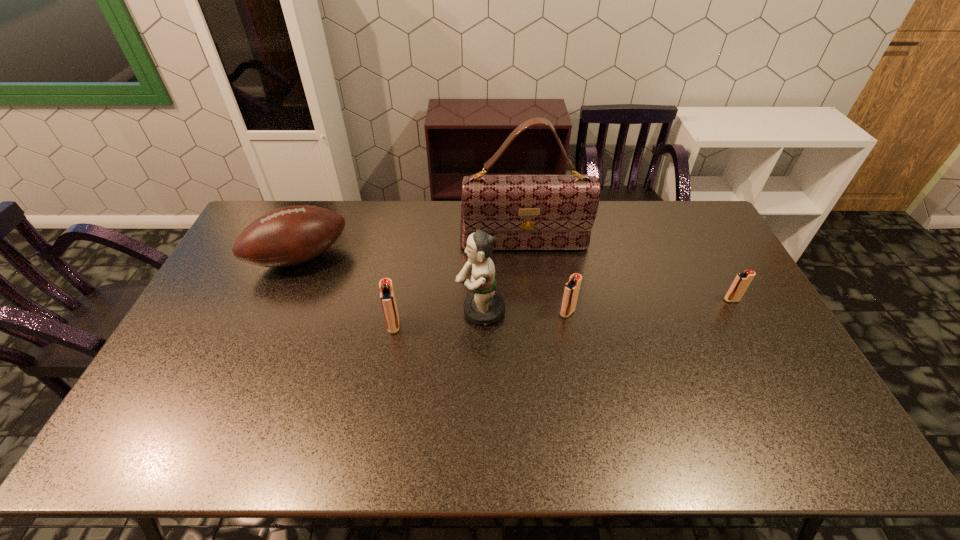
Locate an element on the screen. The height and width of the screenshot is (540, 960). free space located 0.300m on the back of the rightmost igniter is located at coordinates (697, 235).

In order to click on free space located on the back of the football (American) in this screenshot , I will do `click(320, 210)`.

The height and width of the screenshot is (540, 960). Identify the location of vacant region located on the front of the tallest object with the clasp. (529, 286).

The image size is (960, 540). Identify the location of vacant region located 0.080m on the front-facing side of the second tallest object. (430, 310).

At what (x,y) coordinates should I click in order to perform the action: click on free spot located 0.080m on the front-facing side of the second tallest object. Please return your answer as a coordinate pair (x, y). Image resolution: width=960 pixels, height=540 pixels. Looking at the image, I should click on (430, 310).

The width and height of the screenshot is (960, 540). In order to click on blank area located on the front-facing side of the second tallest object in this screenshot , I will do `click(401, 310)`.

Identify the location of football (American) positioned at the far edge. This screenshot has width=960, height=540. (288, 236).

This screenshot has height=540, width=960. Identify the location of handbag present at the far edge. (524, 212).

In order to click on object that is positioned at the left edge in this screenshot , I will do `click(288, 236)`.

The height and width of the screenshot is (540, 960). What are the coordinates of `object present at the right edge` in the screenshot? It's located at (741, 282).